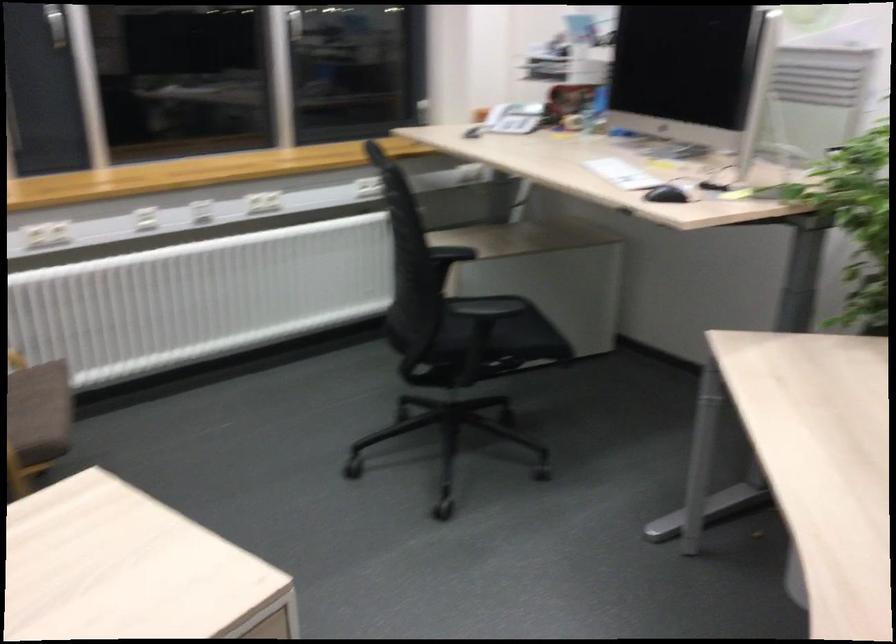
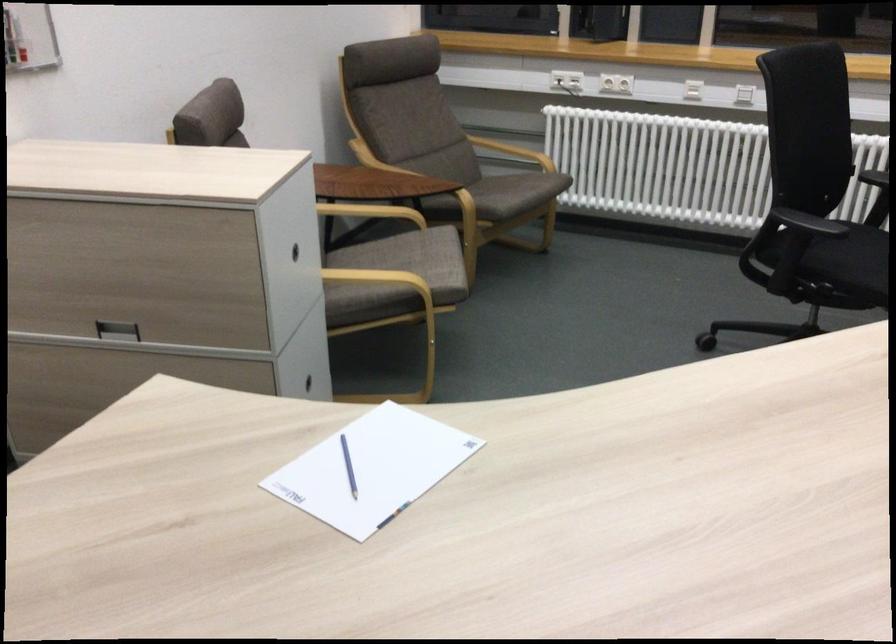
Locate, in the second image, the point that corresponds to (502,333) in the first image.

(849, 267)